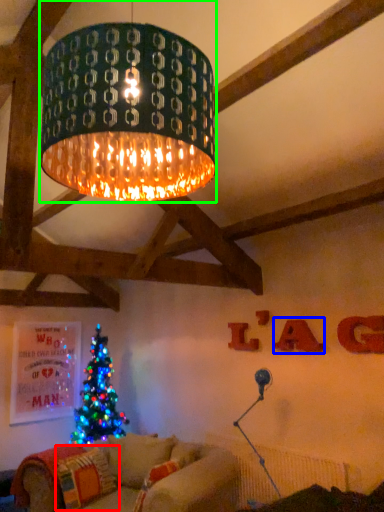
Question: Considering the real-world distances, which object is farthest from pillow (highlighted by a red box)? letter (highlighted by a blue box) or lamp (highlighted by a green box)?

Choices:
 (A) letter
 (B) lamp

Answer: (B)